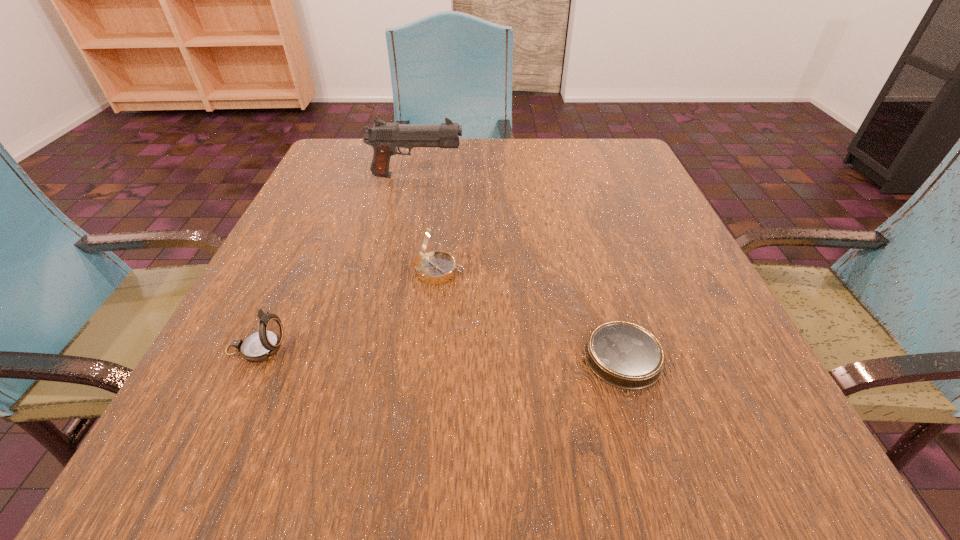
The width and height of the screenshot is (960, 540). Find the location of `vacant position located 0.290m on the back of the rightmost compass`. vacant position located 0.290m on the back of the rightmost compass is located at coordinates (581, 218).

The image size is (960, 540). I want to click on object positioned at the far edge, so click(x=384, y=137).

Find the location of a particular element. This screenshot has width=960, height=540. gun located at the left edge is located at coordinates (384, 137).

The image size is (960, 540). I want to click on compass located in the left edge section of the desktop, so click(262, 345).

At what (x,y) coordinates should I click in order to perform the action: click on object located in the right edge section of the desktop. Please return your answer as a coordinate pair (x, y). This screenshot has width=960, height=540. Looking at the image, I should click on (624, 355).

Locate an element on the screen. The height and width of the screenshot is (540, 960). object at the far left corner is located at coordinates (384, 137).

Identify the location of vacant area at the far edge of the desktop. The height and width of the screenshot is (540, 960). (524, 140).

You are a GUI agent. You are given a task and a screenshot of the screen. Output one action in this format:
    pyautogui.click(x=<x>, y=<y>)
    Task: Click on the blank space at the right edge
    This screenshot has height=540, width=960.
    Given the screenshot: What is the action you would take?
    pyautogui.click(x=712, y=382)

This screenshot has width=960, height=540. I want to click on free space at the near left corner of the desktop, so click(279, 472).

This screenshot has height=540, width=960. I want to click on vacant area at the far right corner, so [597, 138].